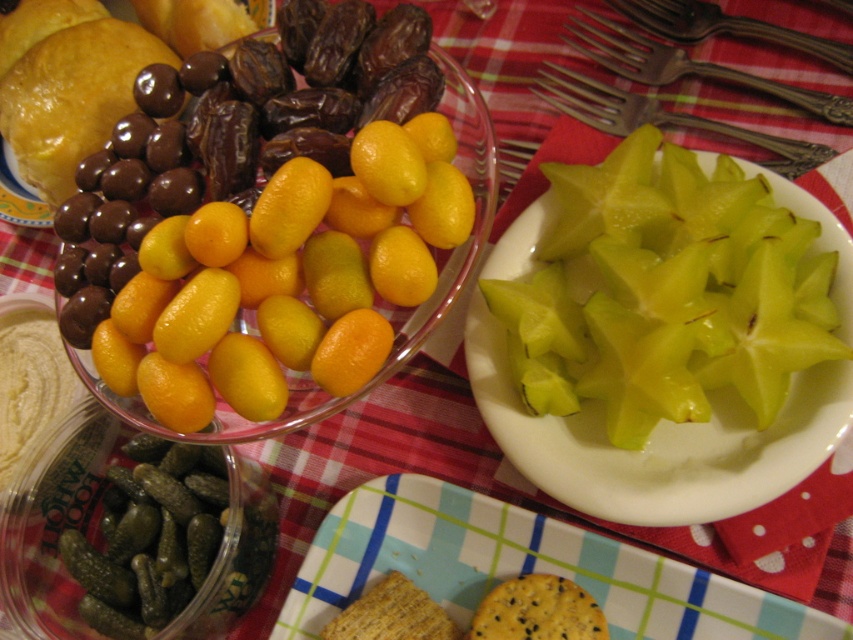
Question: Which of the following is the farthest from the observer?

Choices:
 (A) seeded yellow biscuit at center
 (B) seeded cracker at lower center
 (C) green shiny starfruit at right
 (D) yellow matte kumquats at center

Answer: (A)

Question: Which object is the farthest from the green shiny starfruit at right?

Choices:
 (A) seeded yellow biscuit at center
 (B) polished metal forks at upper right
 (C) seeded cracker at lower center

Answer: (A)

Question: Which point is closer to the camera?

Choices:
 (A) (802, 168)
 (B) (544, 589)
 (C) (352, 500)
 (D) (190, 332)

Answer: (D)

Question: Does seeded cracker at lower center appear over polished metal forks at upper right?

Choices:
 (A) no
 (B) yes

Answer: (A)

Question: Can you confirm if polished metal forks at upper right is positioned above seeded yellow biscuit at center?

Choices:
 (A) no
 (B) yes

Answer: (B)

Question: Can you confirm if yellow matte kumquats at center is smaller than green shiny starfruit at right?

Choices:
 (A) yes
 (B) no

Answer: (A)